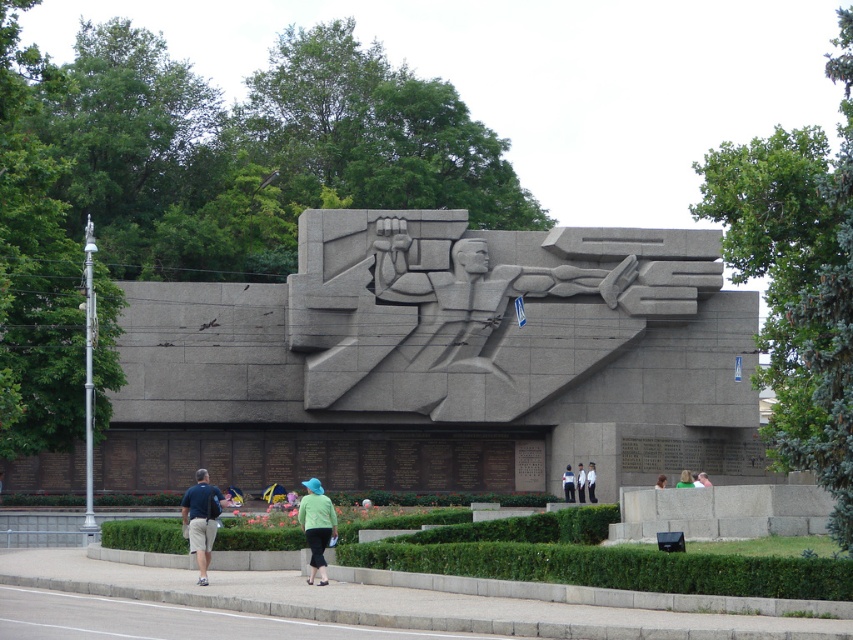
Does dark blue shirt at lower left appear under white uniform at center?

No, dark blue shirt at lower left is not below white uniform at center.

This screenshot has height=640, width=853. Describe the element at coordinates (201, 518) in the screenshot. I see `dark blue shirt at lower left` at that location.

I want to click on dark blue shirt at lower left, so click(x=201, y=518).

Does white fabric at center appear on the left side of green fabric at lower center?

Yes, white fabric at center is to the left of green fabric at lower center.

Does white fabric at center appear under green fabric at lower center?

Yes, white fabric at center is below green fabric at lower center.

Who is more forward, (572, 492) or (677, 483)?

Point (677, 483)

Where is `white fabric at center`? This screenshot has width=853, height=640. white fabric at center is located at coordinates (567, 484).

Between gray stone sculpture at center and white fabric at center, which one has less height?

Standing shorter between the two is white fabric at center.

Is gray stone sculpture at center behind white fabric at center?

Yes, gray stone sculpture at center is behind white fabric at center.

Is point (325, 390) closer to viewer compared to point (573, 484)?

No.

You are a GUI agent. You are given a task and a screenshot of the screen. Output one action in this format:
    pyautogui.click(x=<x>, y=<y>)
    Task: Click on the gray stone sculpture at center
    The width and height of the screenshot is (853, 640).
    Given the screenshot: What is the action you would take?
    pyautogui.click(x=474, y=307)